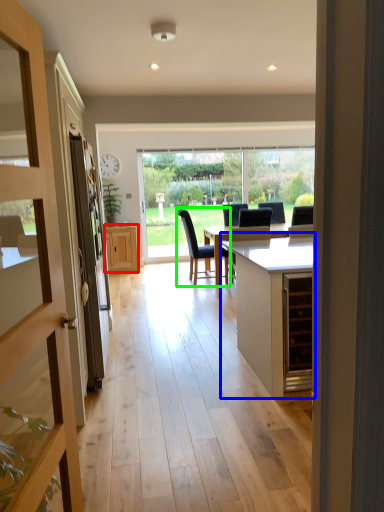
Question: Which is nearer to the cabinetry (highlighted by a red box)? cabinetry (highlighted by a blue box) or chair (highlighted by a green box).

Choices:
 (A) cabinetry
 (B) chair

Answer: (B)